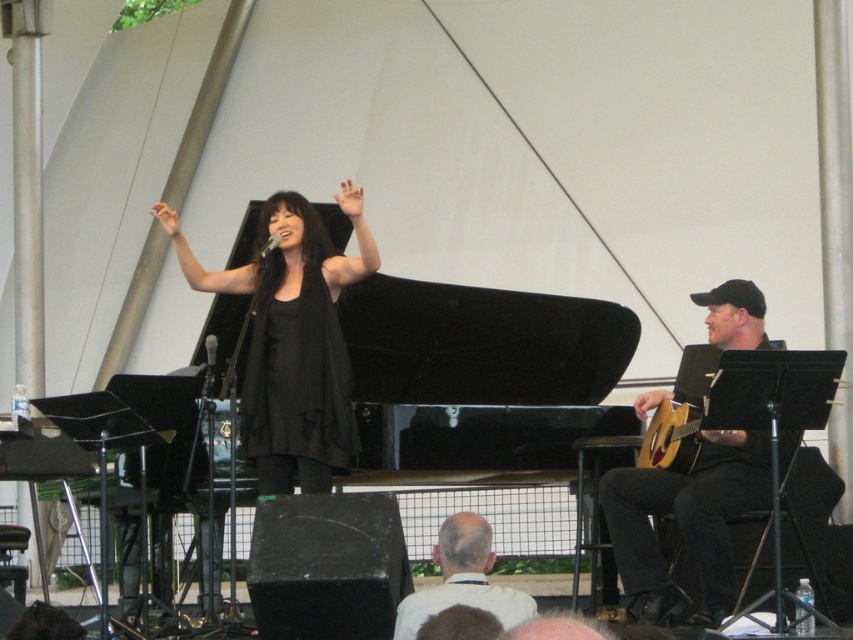
Who is lower down, black matte dress at center or acoustic wood guitar at right?

acoustic wood guitar at right

Does black matte dress at center appear on the left side of acoustic wood guitar at right?

Yes, black matte dress at center is to the left of acoustic wood guitar at right.

Where is `black matte dress at center`? Image resolution: width=853 pixels, height=640 pixels. black matte dress at center is located at coordinates (293, 339).

Which of these two, black matte dress at center or bald head at center, stands taller?

Standing taller between the two is black matte dress at center.

Is point (285, 246) in front of point (466, 598)?

No, it is behind (466, 598).

Where is `black matte dress at center`? black matte dress at center is located at coordinates (293, 339).

Can you confirm if acoustic wood guitar at right is smaller than bald head at center?

No, acoustic wood guitar at right is not smaller than bald head at center.

Who is lower down, acoustic wood guitar at right or bald head at center?

bald head at center is below.

Between point (776, 388) and point (393, 630), which one is positioned in front?

Point (393, 630) is more forward.

This screenshot has width=853, height=640. I want to click on acoustic wood guitar at right, so click(746, 403).